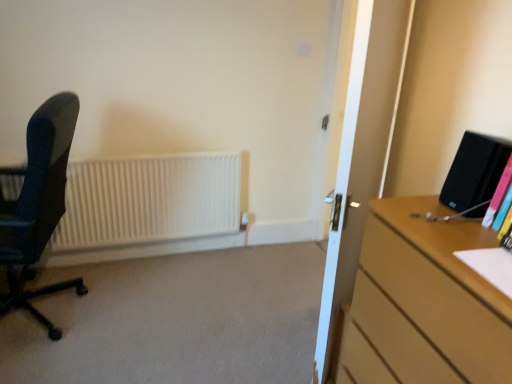
Locate an element on the screen. The height and width of the screenshot is (384, 512). free area in between matte black office chair at left and white matte radiator at left is located at coordinates (151, 279).